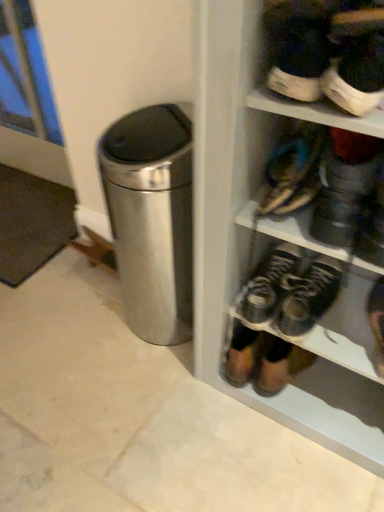
Question: From a real-world perspective, is dark brown leather shoes at center, which is the third footwear from top to bottom, physically located above or below white rubber sneaker at upper right, arranged as the 1th footwear when viewed from the top?

Choices:
 (A) below
 (B) above

Answer: (A)

Question: In terms of width, does dark brown leather shoes at center, the 2th footwear from the bottom, look wider or thinner when compared to white rubber sneaker at upper right, which ranks as the 4th footwear in bottom-to-top order?

Choices:
 (A) wide
 (B) thin

Answer: (A)

Question: Which object is the closest to the white rubber sneaker at upper right, which ranks as the 4th footwear in bottom-to-top order?

Choices:
 (A) dark brown leather shoes at center, which is the third footwear from top to bottom
 (B) leather shoe at lower right, the fourth footwear positioned from the top
 (C) leather sandals at upper right, which appears as the second footwear when viewed from the top

Answer: (C)

Question: Which of these objects is positioned closest to the leather sandals at upper right, which ranks as the third footwear in bottom-to-top order?

Choices:
 (A) white rubber sneaker at upper right, which ranks as the 4th footwear in bottom-to-top order
 (B) dark brown leather shoes at center, the 2th footwear from the bottom
 (C) leather shoe at lower right, the first footwear ordered from the bottom

Answer: (A)